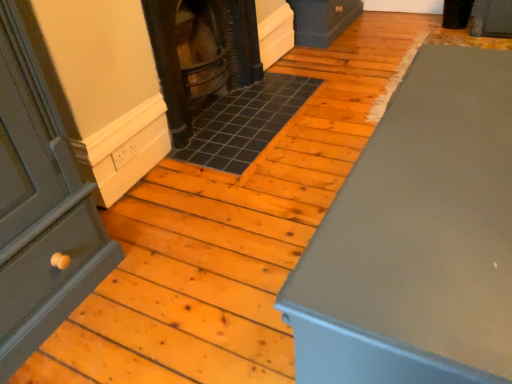
Question: From the image's perspective, is matte gray cabinet at right located beneath dark brown wood stove at center?

Choices:
 (A) yes
 (B) no

Answer: (A)

Question: Considering the relative positions of matte gray cabinet at right and dark brown wood stove at center in the image provided, is matte gray cabinet at right behind dark brown wood stove at center?

Choices:
 (A) no
 (B) yes

Answer: (A)

Question: Is matte gray cabinet at right wider than dark brown wood stove at center?

Choices:
 (A) yes
 (B) no

Answer: (A)

Question: Is matte gray cabinet at right not close to dark brown wood stove at center?

Choices:
 (A) no
 (B) yes

Answer: (B)

Question: From a real-world perspective, is matte gray cabinet at right on dark brown wood stove at center?

Choices:
 (A) yes
 (B) no

Answer: (B)

Question: Can you confirm if matte gray cabinet at right is thinner than dark brown wood stove at center?

Choices:
 (A) yes
 (B) no

Answer: (B)

Question: Can you confirm if dark brown wood stove at center is positioned to the right of matte gray cabinet at right?

Choices:
 (A) yes
 (B) no

Answer: (B)

Question: Can you confirm if dark brown wood stove at center is wider than matte gray cabinet at right?

Choices:
 (A) yes
 (B) no

Answer: (B)

Question: Considering the relative sizes of dark brown wood stove at center and matte gray cabinet at right in the image provided, is dark brown wood stove at center smaller than matte gray cabinet at right?

Choices:
 (A) yes
 (B) no

Answer: (A)

Question: Is dark brown wood stove at center far away from matte gray cabinet at right?

Choices:
 (A) no
 (B) yes

Answer: (B)

Question: Is dark brown wood stove at center shorter than matte gray cabinet at right?

Choices:
 (A) yes
 (B) no

Answer: (B)

Question: Is dark brown wood stove at center oriented away from matte gray cabinet at right?

Choices:
 (A) yes
 (B) no

Answer: (B)

Question: Considering the positions of dark brown wood stove at center and matte gray cabinet at right in the image, is dark brown wood stove at center bigger or smaller than matte gray cabinet at right?

Choices:
 (A) big
 (B) small

Answer: (B)